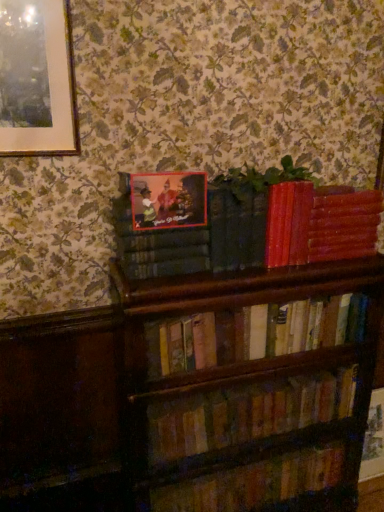
Question: From the image's perspective, is wooden book at lower center, which is the fourth book from top to bottom, below wooden bookshelf at center, the second book viewed from the top?

Choices:
 (A) yes
 (B) no

Answer: (A)

Question: From a real-world perspective, is wooden book at lower center, which is the fourth book from top to bottom, under wooden bookshelf at center, the second book viewed from the top?

Choices:
 (A) yes
 (B) no

Answer: (A)

Question: From the image's perspective, is wooden book at lower center, which is the fourth book from top to bottom, on wooden bookshelf at center, the 3th book positioned from the bottom?

Choices:
 (A) no
 (B) yes

Answer: (A)

Question: Is wooden book at lower center, which is the fourth book from top to bottom, to the left of wooden bookshelf at center, the second book viewed from the top, from the viewer's perspective?

Choices:
 (A) no
 (B) yes

Answer: (A)

Question: From a real-world perspective, does wooden book at lower center, which is the fourth book from top to bottom, stand above wooden bookshelf at center, the 3th book positioned from the bottom?

Choices:
 (A) no
 (B) yes

Answer: (A)

Question: Does point (218, 500) appear closer or farther from the camera than point (261, 425)?

Choices:
 (A) farther
 (B) closer

Answer: (A)

Question: Is wooden book at lower center, which ranks as the first book in bottom-to-top order, in front of or behind wooden bookshelf at lower center, the 3th book positioned from the top, in the image?

Choices:
 (A) behind
 (B) front

Answer: (A)

Question: Would you say wooden book at lower center, which ranks as the first book in bottom-to-top order, is to the left or to the right of wooden bookshelf at lower center, arranged as the second book when ordered from the bottom, in the picture?

Choices:
 (A) right
 (B) left

Answer: (B)

Question: From the image's perspective, is wooden book at lower center, which is the fourth book from top to bottom, located above or below wooden bookshelf at lower center, arranged as the second book when ordered from the bottom?

Choices:
 (A) above
 (B) below

Answer: (B)

Question: Is wooden bookshelf at center, the 3th book positioned from the bottom, taller or shorter than wooden bookshelf at lower center, arranged as the second book when ordered from the bottom?

Choices:
 (A) short
 (B) tall

Answer: (A)

Question: From the image's perspective, is wooden bookshelf at center, the second book viewed from the top, above or below wooden bookshelf at lower center, arranged as the second book when ordered from the bottom?

Choices:
 (A) above
 (B) below

Answer: (A)

Question: Is wooden bookshelf at center, the second book viewed from the top, inside or outside of wooden bookshelf at lower center, arranged as the second book when ordered from the bottom?

Choices:
 (A) outside
 (B) inside

Answer: (A)

Question: Based on their positions, is wooden bookshelf at center, the 3th book positioned from the bottom, located to the left or right of wooden bookshelf at lower center, arranged as the second book when ordered from the bottom?

Choices:
 (A) right
 (B) left

Answer: (B)

Question: From their relative heights in the image, would you say green matte plant at upper center is taller or shorter than wooden bookshelf at lower center, arranged as the second book when ordered from the bottom?

Choices:
 (A) short
 (B) tall

Answer: (A)

Question: In the image, is green matte plant at upper center positioned in front of or behind wooden bookshelf at lower center, arranged as the second book when ordered from the bottom?

Choices:
 (A) behind
 (B) front

Answer: (B)